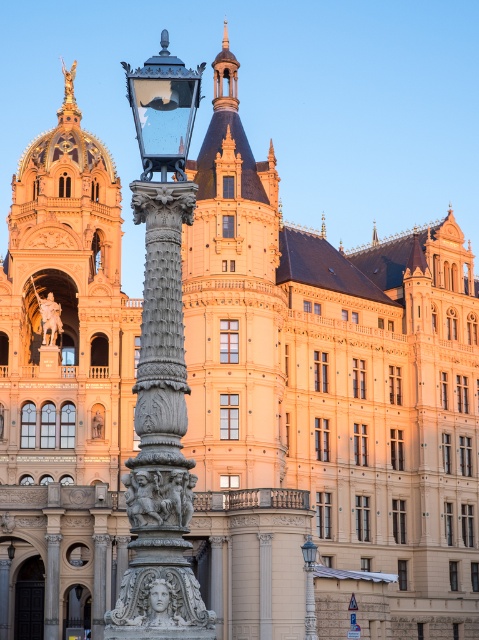
Question: Which point is farther from the camera taking this photo?

Choices:
 (A) (155, 100)
 (B) (309, 602)

Answer: (B)

Question: Does polished bronze lamp post at center have a greater width compared to polished brass lantern at center?

Choices:
 (A) yes
 (B) no

Answer: (A)

Question: Is the position of carved stone sculpture at center more distant than that of polished brass lantern at center?

Choices:
 (A) yes
 (B) no

Answer: (B)

Question: Does polished bronze lamp post at center have a smaller size compared to polished brass lantern at center?

Choices:
 (A) no
 (B) yes

Answer: (A)

Question: Which of the following is the closest to the observer?

Choices:
 (A) (59, 324)
 (B) (143, 516)

Answer: (B)

Question: Which point appears farthest from the camera in this image?

Choices:
 (A) (49, 298)
 (B) (152, 493)

Answer: (A)